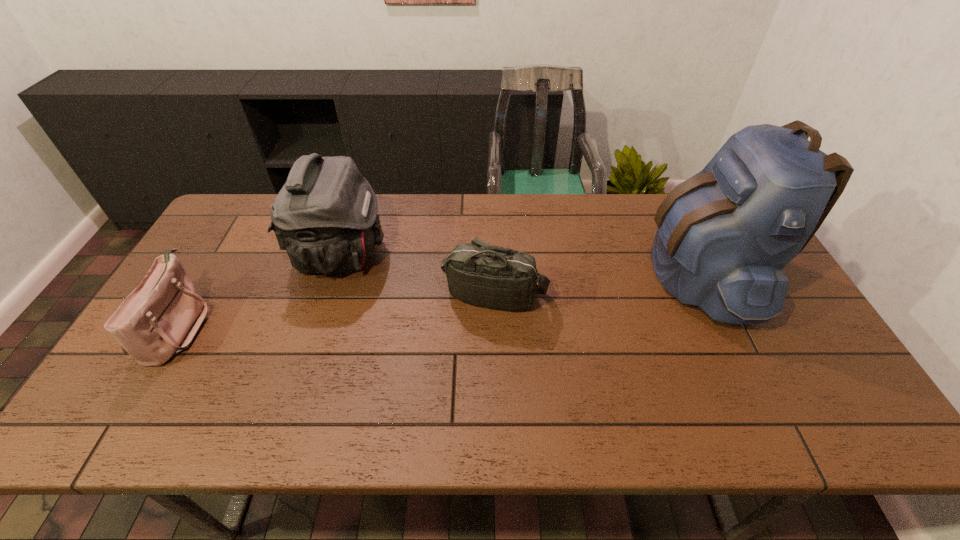
The height and width of the screenshot is (540, 960). In the image, there is a desktop. Find the location of `vacant space at the near edge`. vacant space at the near edge is located at coordinates (788, 413).

Where is `vacant area at the left edge of the desktop`? vacant area at the left edge of the desktop is located at coordinates (124, 370).

The width and height of the screenshot is (960, 540). In the image, there is a desktop. Find the location of `free space at the right edge`. free space at the right edge is located at coordinates (805, 366).

Image resolution: width=960 pixels, height=540 pixels. In order to click on vacant space at the far left corner of the desktop in this screenshot , I will do `click(231, 215)`.

Where is `vacant space in between the second shortest object and the leftmost object`? vacant space in between the second shortest object and the leftmost object is located at coordinates (337, 310).

I want to click on free area in between the third tallest object and the tallest object, so click(x=597, y=284).

At what (x,y) coordinates should I click in order to perform the action: click on unoccupied position between the second tallest shoulder bag and the leftmost shoulder bag. Please return your answer as a coordinate pair (x, y). Looking at the image, I should click on (337, 310).

Image resolution: width=960 pixels, height=540 pixels. What are the coordinates of `unoccupied position between the tallest object and the shortest shoulder bag` in the screenshot? It's located at tap(440, 300).

Locate an element on the screen. Image resolution: width=960 pixels, height=540 pixels. vacant space in between the leftmost object and the tallest shoulder bag is located at coordinates 260,291.

Identify the location of free area in between the backpack and the third object from left to right. (597, 284).